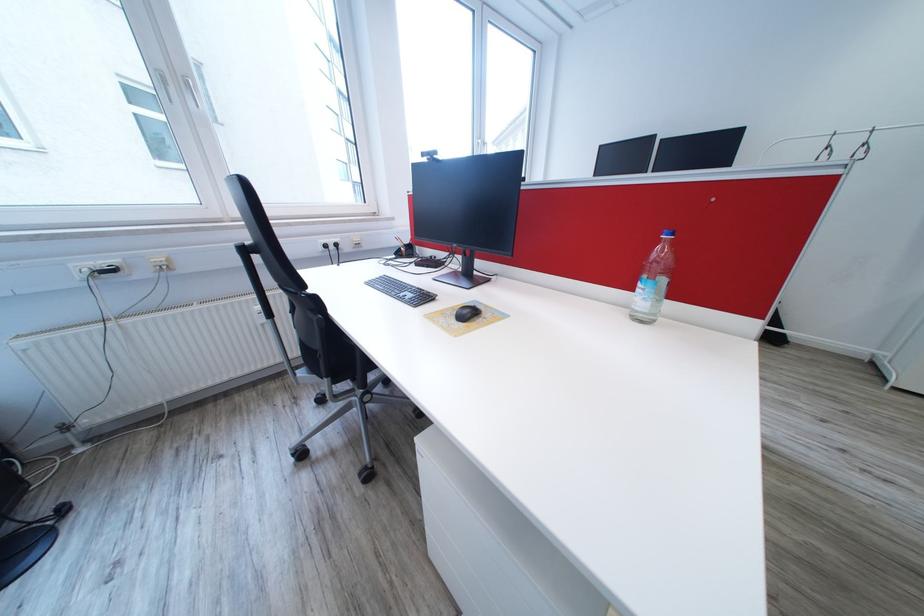
This screenshot has height=616, width=924. I want to click on white window handle, so click(x=190, y=91).